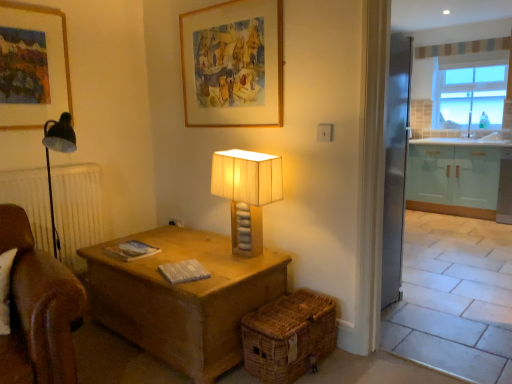
What is the approximate height of clear glass window at upper right?

The height of clear glass window at upper right is 39.36 inches.

At what (x,y) coordinates should I click in order to perform the action: click on clear glass window at upper right. Please return your answer as a coordinate pair (x, y). Looking at the image, I should click on (469, 90).

Describe the element at coordinates (289, 336) in the screenshot. I see `woven brown basket at lower center` at that location.

What is the approximate height of white glossy sink at right?

It is 15.64 centimeters.

Describe the element at coordinates (32, 65) in the screenshot. I see `wooden picture frame at upper left, the 2th picture frame from the right` at that location.

Where is `clear glass window at upper right`? Image resolution: width=512 pixels, height=384 pixels. clear glass window at upper right is located at coordinates (469, 90).

Is wooden picture frame at upper left, the 1th picture frame viewed from the left, bigger than woven brown basket at lower center?

No.

From the image's perspective, count 1st picture frames upward from the woven brown basket at lower center and point to it. Please provide its 2D coordinates.

[(32, 65)]

In terms of height, does wooden picture frame at upper left, the 2th picture frame from the right, look taller or shorter compared to woven brown basket at lower center?

Clearly, wooden picture frame at upper left, the 2th picture frame from the right, is taller compared to woven brown basket at lower center.

How different are the orientations of wooden picture frame at upper left, the 2th picture frame from the right, and woven brown basket at lower center in degrees?

The angular difference between wooden picture frame at upper left, the 2th picture frame from the right, and woven brown basket at lower center is 1.06 degrees.

Can you tell me how much white glossy sink at right and wooden picture frame at upper left, the 1th picture frame viewed from the left, differ in facing direction?

The facing directions of white glossy sink at right and wooden picture frame at upper left, the 1th picture frame viewed from the left, are 86.8 degrees apart.

From the image's perspective, between white glossy sink at right and wooden picture frame at upper left, the 1th picture frame viewed from the left, which one is located above?

wooden picture frame at upper left, the 1th picture frame viewed from the left, is shown above in the image.

Which is in front, point (502, 138) or point (38, 97)?

The point (38, 97) is more forward.

Does white glossy sink at right have a lesser width compared to woven brown basket at lower center?

Indeed, white glossy sink at right has a lesser width compared to woven brown basket at lower center.

Is white glossy sink at right to the left or to the right of woven brown basket at lower center in the image?

From the image, it's evident that white glossy sink at right is to the right of woven brown basket at lower center.

From the image's perspective, is white glossy sink at right on top of woven brown basket at lower center?

Yes, from the image's perspective, white glossy sink at right is above woven brown basket at lower center.

From a real-world perspective, is white glossy sink at right under woven brown basket at lower center?

Incorrect, from a real-world perspective, white glossy sink at right is higher than woven brown basket at lower center.

At what (x,y) coordinates should I click in order to perform the action: click on sink that is on the right side of woven brown basket at lower center. Please return your answer as a coordinate pair (x, y). The width and height of the screenshot is (512, 384). Looking at the image, I should click on (481, 138).

Is woven brown basket at lower center located outside white glossy sink at right?

woven brown basket at lower center lies outside white glossy sink at right's area.

Is woven brown basket at lower center smaller than white glossy sink at right?

Incorrect, woven brown basket at lower center is not smaller in size than white glossy sink at right.

Is woven brown basket at lower center in front of or behind white glossy sink at right in the image?

Visually, woven brown basket at lower center is located in front of white glossy sink at right.

In terms of height, does wooden picture frame at upper center, the second picture frame viewed from the left, look taller or shorter compared to woven brown basket at lower center?

wooden picture frame at upper center, the second picture frame viewed from the left, is taller than woven brown basket at lower center.

Considering the relative positions of wooden picture frame at upper center, the second picture frame viewed from the left, and woven brown basket at lower center in the image provided, is wooden picture frame at upper center, the second picture frame viewed from the left, to the left or to the right of woven brown basket at lower center?

From the image, it's evident that wooden picture frame at upper center, the second picture frame viewed from the left, is to the left of woven brown basket at lower center.

Is wooden picture frame at upper center, the second picture frame viewed from the left, not within woven brown basket at lower center?

Indeed, wooden picture frame at upper center, the second picture frame viewed from the left, is completely outside woven brown basket at lower center.

Which object is more forward, wooden picture frame at upper center, the first picture frame viewed from the right, or woven brown basket at lower center?

woven brown basket at lower center is in front.

Is woven brown basket at lower center oriented away from wooden picture frame at upper center, the first picture frame viewed from the right?

No, woven brown basket at lower center is not facing away from wooden picture frame at upper center, the first picture frame viewed from the right.

Is woven brown basket at lower center closer to the viewer compared to wooden picture frame at upper center, the second picture frame viewed from the left?

Yes, the depth of woven brown basket at lower center is less than that of wooden picture frame at upper center, the second picture frame viewed from the left.

Based on their positions, is woven brown basket at lower center located to the left or right of wooden picture frame at upper center, the second picture frame viewed from the left?

Clearly, woven brown basket at lower center is on the right of wooden picture frame at upper center, the second picture frame viewed from the left, in the image.

Based on the photo, is wooden picture frame at upper center, the first picture frame viewed from the right, surrounded by woven brown basket at lower center?

Definitely not — wooden picture frame at upper center, the first picture frame viewed from the right, is not inside woven brown basket at lower center.

Considering the relative positions of clear glass window at upper right and woven brown basket at lower center in the image provided, is clear glass window at upper right to the left or to the right of woven brown basket at lower center?

From the image, it's evident that clear glass window at upper right is to the right of woven brown basket at lower center.

You are a GUI agent. You are given a task and a screenshot of the screen. Output one action in this format:
    pyautogui.click(x=<x>, y=<y>)
    Task: Click on the crate on the left side of clear glass window at upper right
    
    Given the screenshot: What is the action you would take?
    pyautogui.click(x=289, y=336)

Is clear glass window at upper right bigger or smaller than woven brown basket at lower center?

clear glass window at upper right is bigger than woven brown basket at lower center.

Who is shorter, clear glass window at upper right or woven brown basket at lower center?

Standing shorter between the two is woven brown basket at lower center.

From the woven brown basket at lower center, count the 2nd picture frame to the left and point to it. Please provide its 2D coordinates.

[(32, 65)]

Find the location of a particular element. picture frame that is the 1st one when counting forward from the white glossy sink at right is located at coordinates (32, 65).

Based on their spatial positions, is wooden table lamp at center or wooden picture frame at upper left, the 1th picture frame viewed from the left, closer to wooden picture frame at upper center, the first picture frame viewed from the right?

wooden table lamp at center is positioned closer to the anchor wooden picture frame at upper center, the first picture frame viewed from the right.

Based on their spatial positions, is woven brown basket at lower center or wooden picture frame at upper center, the second picture frame viewed from the left, closer to wooden picture frame at upper left, the 1th picture frame viewed from the left?

wooden picture frame at upper center, the second picture frame viewed from the left, is closer to wooden picture frame at upper left, the 1th picture frame viewed from the left.

Estimate the real-world distances between objects in this image. Which object is closer to white glossy sink at right, clear glass window at upper right or wooden picture frame at upper left, the 1th picture frame viewed from the left?

clear glass window at upper right is closer to white glossy sink at right.

Estimate the real-world distances between objects in this image. Which object is further from woven brown basket at lower center, wooden table lamp at center or wooden picture frame at upper center, the first picture frame viewed from the right?

Based on the image, wooden picture frame at upper center, the first picture frame viewed from the right, appears to be further to woven brown basket at lower center.

Consider the image. Looking at the image, which one is located closer to wooden picture frame at upper center, the first picture frame viewed from the right, white glossy sink at right or wooden picture frame at upper left, the 2th picture frame from the right?

wooden picture frame at upper left, the 2th picture frame from the right, lies closer to wooden picture frame at upper center, the first picture frame viewed from the right, than the other object.

Looking at the image, which one is located closer to clear glass window at upper right, woven brown basket at lower center or white glossy sink at right?

white glossy sink at right is positioned closer to the anchor clear glass window at upper right.

When comparing their distances from wooden picture frame at upper center, the second picture frame viewed from the left, does wooden table lamp at center or clear glass window at upper right seem further?

clear glass window at upper right lies further to wooden picture frame at upper center, the second picture frame viewed from the left, than the other object.

Looking at the image, which one is located closer to white glossy sink at right, wooden table lamp at center or woven brown basket at lower center?

The object closer to white glossy sink at right is wooden table lamp at center.

Image resolution: width=512 pixels, height=384 pixels. Identify the location of picture frame situated between wooden picture frame at upper left, the 2th picture frame from the right, and clear glass window at upper right from left to right. (233, 64).

Where is `crate located between wooden picture frame at upper left, the 1th picture frame viewed from the left, and clear glass window at upper right in the left-right direction`? This screenshot has height=384, width=512. crate located between wooden picture frame at upper left, the 1th picture frame viewed from the left, and clear glass window at upper right in the left-right direction is located at coordinates (289, 336).

I want to click on sink between wooden table lamp at center and clear glass window at upper right from front to back, so click(x=481, y=138).

The height and width of the screenshot is (384, 512). What are the coordinates of `lamp positioned between woven brown basket at lower center and clear glass window at upper right from near to far` in the screenshot? It's located at (247, 193).